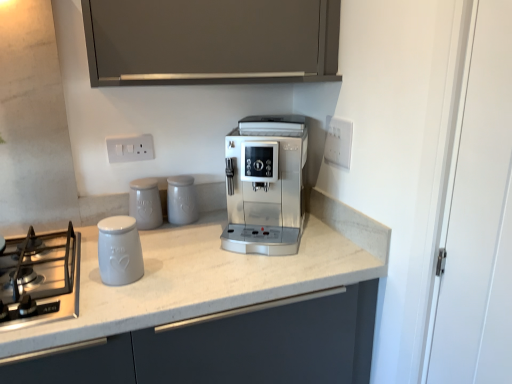
Question: From the image's perspective, does white marble countertop at center appear higher than white plastic electric outlet at upper center, which ranks as the 2th electric outlet in right-to-left order?

Choices:
 (A) no
 (B) yes

Answer: (A)

Question: From the image's perspective, is white marble countertop at center under white plastic electric outlet at upper center, which ranks as the 2th electric outlet in right-to-left order?

Choices:
 (A) yes
 (B) no

Answer: (A)

Question: Does white marble countertop at center have a smaller size compared to white plastic electric outlet at upper center, positioned as the first electric outlet in left-to-right order?

Choices:
 (A) yes
 (B) no

Answer: (B)

Question: Is white plastic electric outlet at upper center, positioned as the first electric outlet in left-to-right order, inside white marble countertop at center?

Choices:
 (A) yes
 (B) no

Answer: (B)

Question: Does white marble countertop at center have a lesser width compared to white plastic electric outlet at upper center, which ranks as the 2th electric outlet in right-to-left order?

Choices:
 (A) no
 (B) yes

Answer: (A)

Question: Considering the relative positions of white marble countertop at center and white plastic electric outlet at upper center, positioned as the first electric outlet in left-to-right order, in the image provided, is white marble countertop at center to the left of white plastic electric outlet at upper center, positioned as the first electric outlet in left-to-right order, from the viewer's perspective?

Choices:
 (A) yes
 (B) no

Answer: (B)

Question: Does matte ceramic canister at center, marked as the third kitchen appliance in a front-to-back arrangement, have a larger size compared to matte ceramic jar at center, the 2th kitchen appliance in the front-to-back sequence?

Choices:
 (A) no
 (B) yes

Answer: (A)

Question: Is matte ceramic canister at center, placed as the 1th kitchen appliance when sorted from back to front, outside matte ceramic jar at center, the 2th kitchen appliance in the front-to-back sequence?

Choices:
 (A) yes
 (B) no

Answer: (A)

Question: Can you confirm if matte ceramic canister at center, placed as the 1th kitchen appliance when sorted from back to front, is taller than matte ceramic jar at center, the 2th kitchen appliance in the front-to-back sequence?

Choices:
 (A) no
 (B) yes

Answer: (A)

Question: From the image's perspective, is matte ceramic canister at center, marked as the third kitchen appliance in a front-to-back arrangement, below matte ceramic jar at center, which is the second kitchen appliance from back to front?

Choices:
 (A) yes
 (B) no

Answer: (B)

Question: From the image's perspective, is matte ceramic canister at center, placed as the 1th kitchen appliance when sorted from back to front, located above matte ceramic jar at center, the 2th kitchen appliance in the front-to-back sequence?

Choices:
 (A) yes
 (B) no

Answer: (A)

Question: Is matte ceramic jar at center, which is the second kitchen appliance from back to front, a part of matte ceramic canister at center, marked as the third kitchen appliance in a front-to-back arrangement?

Choices:
 (A) yes
 (B) no

Answer: (B)

Question: Is white plastic electric outlet at upper center, which ranks as the 2th electric outlet in right-to-left order, further to camera compared to white plastic electrical outlet at upper right, positioned as the second electric outlet in left-to-right order?

Choices:
 (A) yes
 (B) no

Answer: (A)